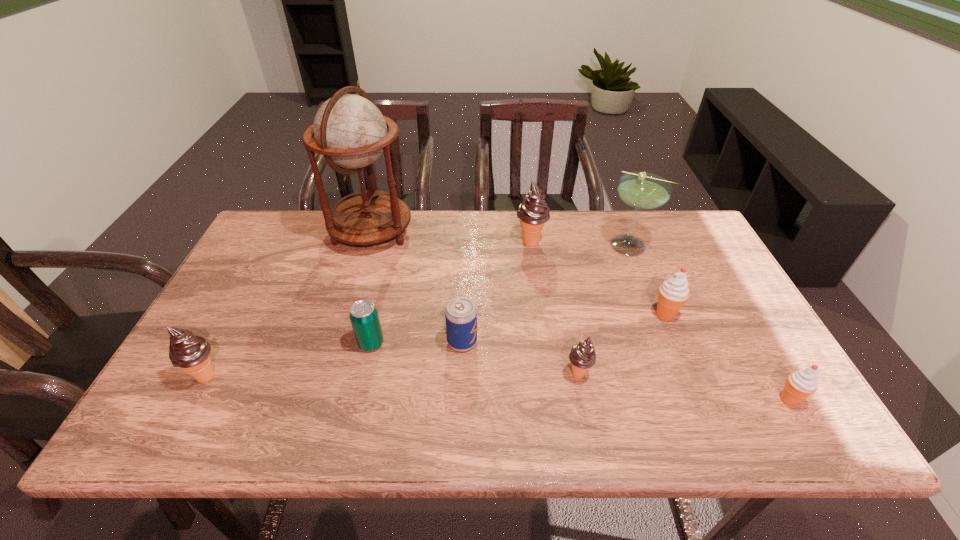
Locate an element on the screen. The image size is (960, 540). object that is at the near right corner is located at coordinates (801, 384).

This screenshot has height=540, width=960. In the image, there is a desktop. What are the coordinates of `free space at the far edge` in the screenshot? It's located at (573, 213).

Find the location of a particular element. free space at the near edge is located at coordinates (411, 429).

In the image, there is a desktop. Identify the location of vacant space at the left edge. This screenshot has width=960, height=540. (237, 310).

Identify the location of vacant space at the right edge of the desktop. (694, 325).

You are a GUI agent. You are given a task and a screenshot of the screen. Output one action in this format:
    pyautogui.click(x=<x>, y=<y>)
    Task: Click on the free space at the near left corner of the desktop
    Image resolution: width=960 pixels, height=540 pixels.
    Given the screenshot: What is the action you would take?
    pyautogui.click(x=161, y=415)

You are a GUI agent. You are given a task and a screenshot of the screen. Output one action in this format:
    pyautogui.click(x=<x>, y=<y>)
    Task: Click on the empty location between the fourth object from left to right and the leftmost object
    The height and width of the screenshot is (540, 960).
    Given the screenshot: What is the action you would take?
    pyautogui.click(x=334, y=359)

Find the location of `vacant point located between the left beer can and the farther red icecream`. vacant point located between the left beer can and the farther red icecream is located at coordinates (518, 329).

Where is `vacant area that lies between the smallest chocolate icecream and the green martini`? This screenshot has height=540, width=960. vacant area that lies between the smallest chocolate icecream and the green martini is located at coordinates (605, 309).

What are the coordinates of `vacant area that lies between the smallest chocolate icecream and the tallest icecream` in the screenshot? It's located at (555, 308).